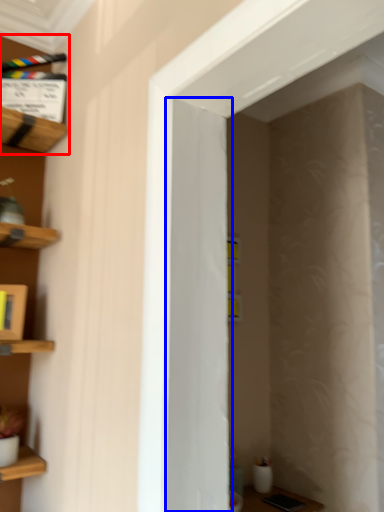
Question: Which object appears farthest to the camera in this image, shelf (highlighted by a red box) or door (highlighted by a blue box)?

Choices:
 (A) shelf
 (B) door

Answer: (A)